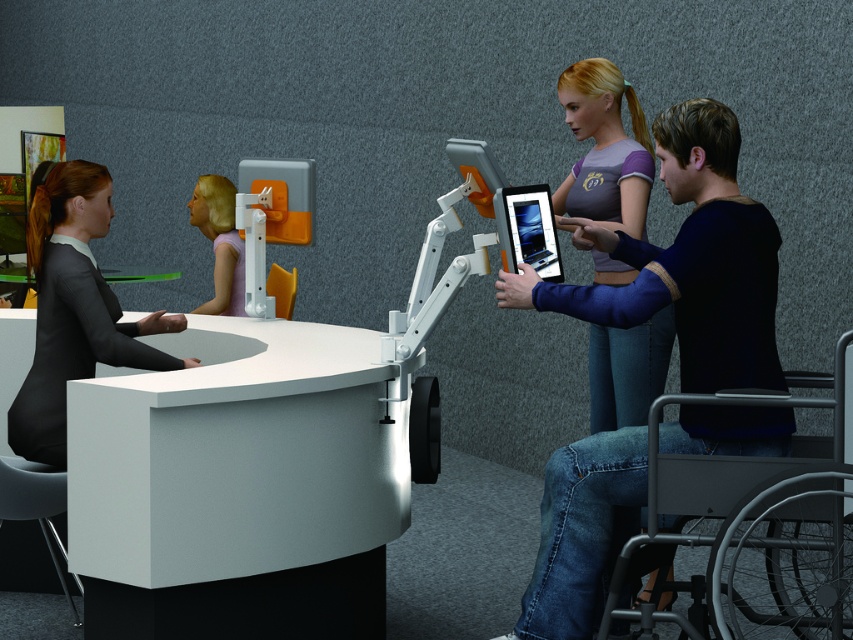
Question: Can you confirm if metallic blue wheelchair at right is positioned to the right of black fabric suit at left?

Choices:
 (A) yes
 (B) no

Answer: (A)

Question: Does metallic blue wheelchair at right have a smaller size compared to black fabric suit at left?

Choices:
 (A) no
 (B) yes

Answer: (A)

Question: Which object appears closest to the camera in this image?

Choices:
 (A) pastel purple fabric at upper center
 (B) black fabric suit at left
 (C) silver metallic wheelchair at lower right
 (D) purple matte shirt at upper right

Answer: (C)

Question: Can you confirm if silver metallic wheelchair at lower right is thinner than pastel purple fabric at upper center?

Choices:
 (A) yes
 (B) no

Answer: (B)

Question: Based on their relative distances, which object is nearer to the black fabric suit at left?

Choices:
 (A) purple matte shirt at upper right
 (B) metallic blue wheelchair at right
 (C) white glossy information desk at left

Answer: (C)

Question: Which of the following is the farthest from the observer?

Choices:
 (A) purple matte shirt at upper right
 (B) black fabric suit at left
 (C) silver metallic wheelchair at lower right
 (D) metallic blue wheelchair at right

Answer: (A)